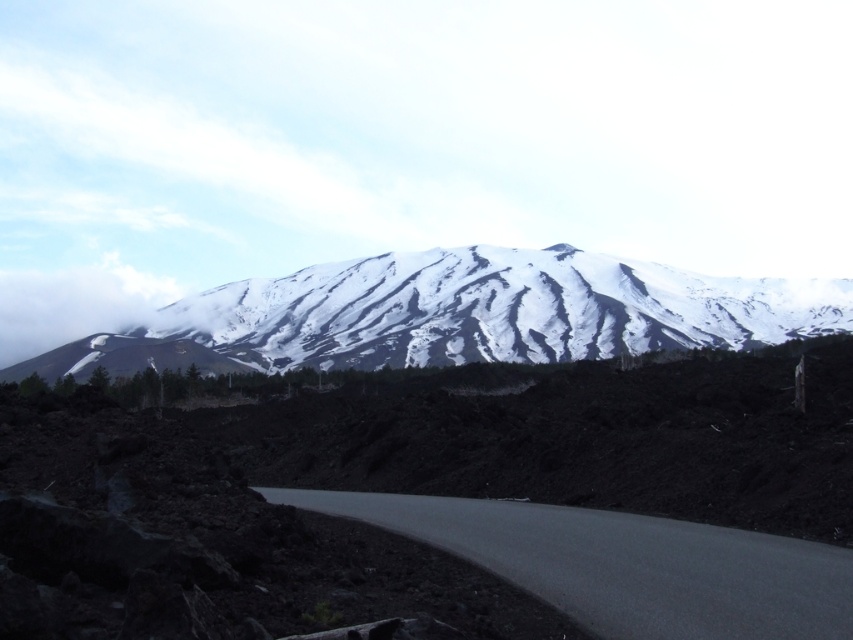
You are a hiker planning to take a photo of the snow mountain. You have a camera with a wide angle lens that can capture everything above the black asphalt road at center. Will your photo include the white fluffy cloud at upper left?

The black asphalt road at center is below the white fluffy cloud at upper left, so yes, the photo will include the white fluffy cloud at upper left because it is positioned above the road.

You are standing at the point with coordinates point (88, 289) and want to reach the point with coordinates point (567, 348). According to the image, which direction should you move to get closer to your destination?

You should move forward because point (567, 348) is in front of point (88, 289).

You are standing at the point marked as point (457, 314) in the image. Based on the scene description, what type of terrain are you currently standing on?

The point (457, 314) is on snowy volcanic peak at center, so you are standing on a snow covered volcanic peak.